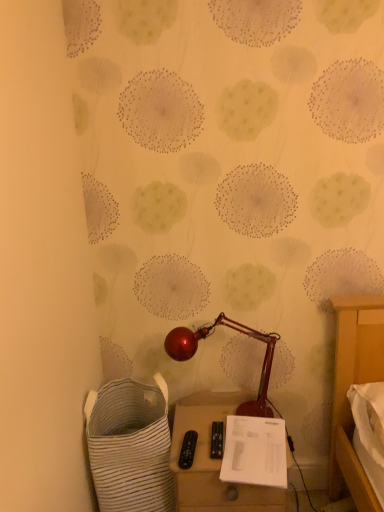
This screenshot has height=512, width=384. Identify the location of vacant area on top of white paper at lower center (from a real-world perspective). [242, 438].